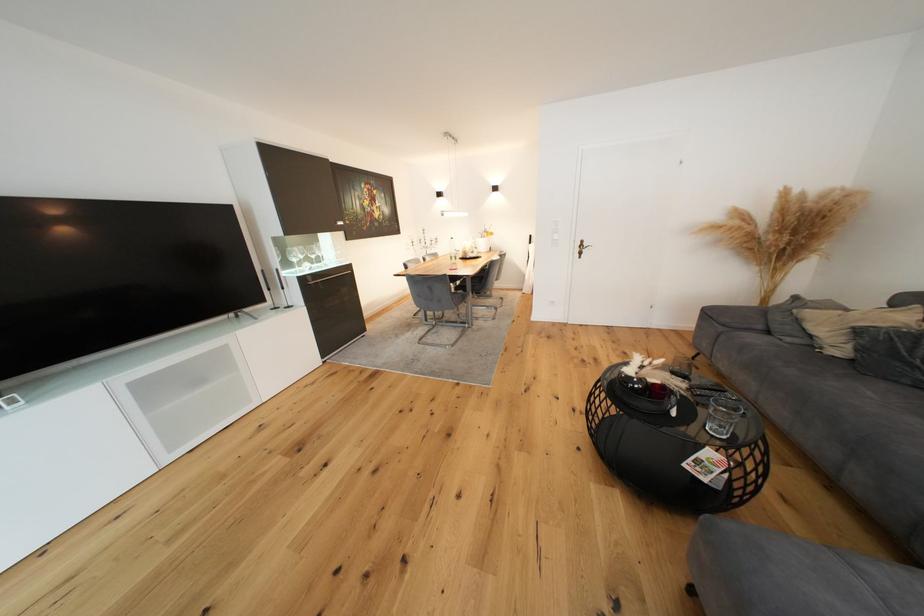
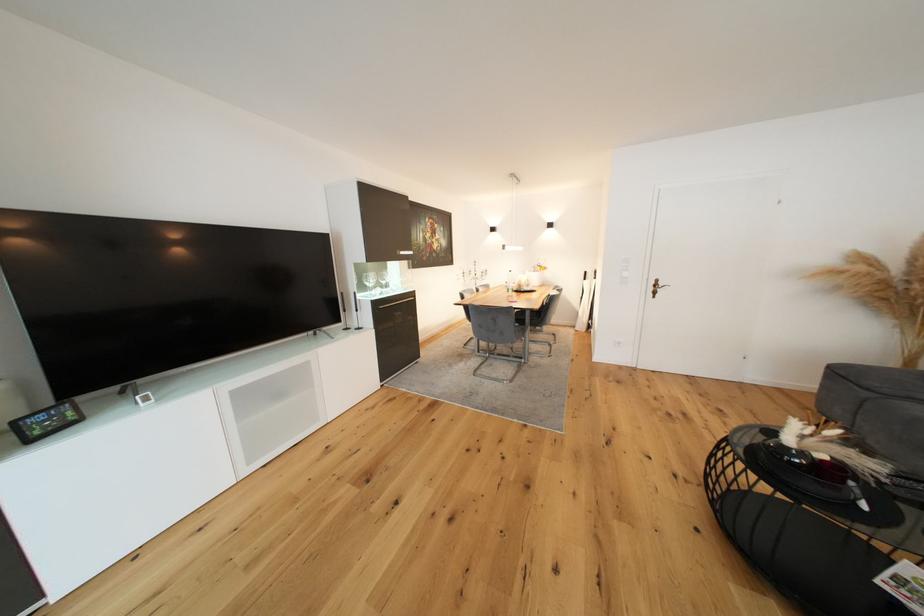
Question: How did the camera likely rotate?

Choices:
 (A) Left
 (B) Right
 (C) Up
 (D) Down

Answer: (C)